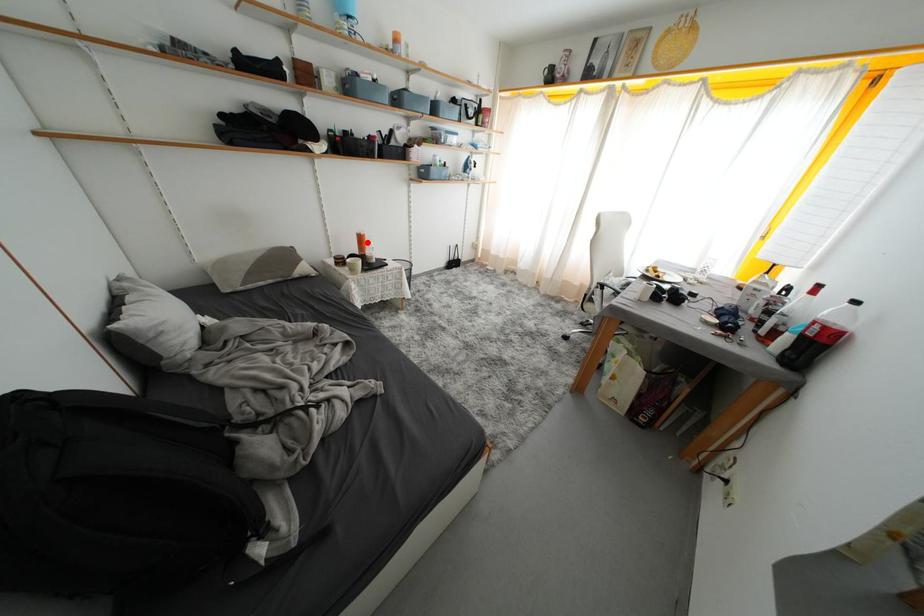
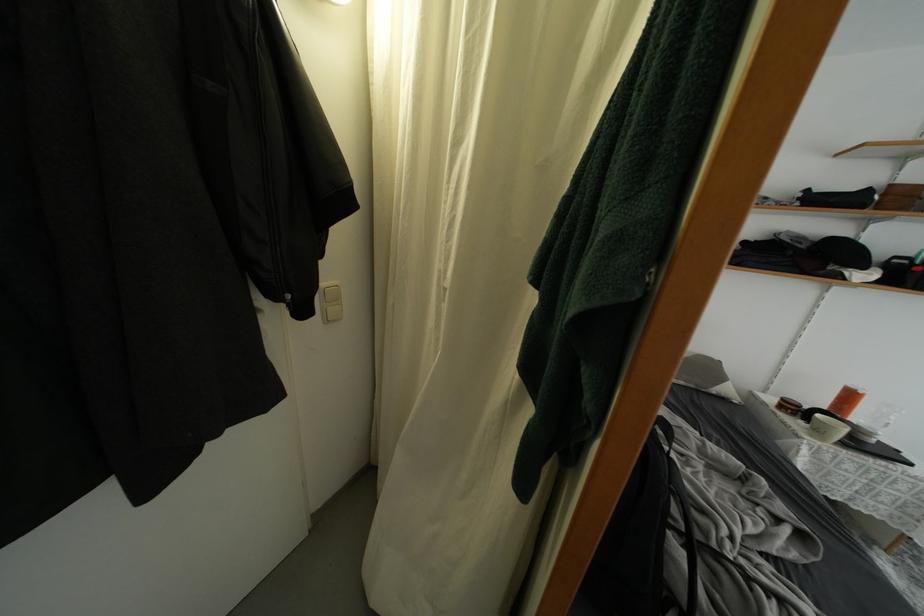
Question: I am providing you with two images of the same scene from different viewpoints. Given a red point in image1, look at the same physical point in image2. Is it:

Choices:
 (A) Closer to the viewpoint
 (B) Farther from the viewpoint

Answer: (B)